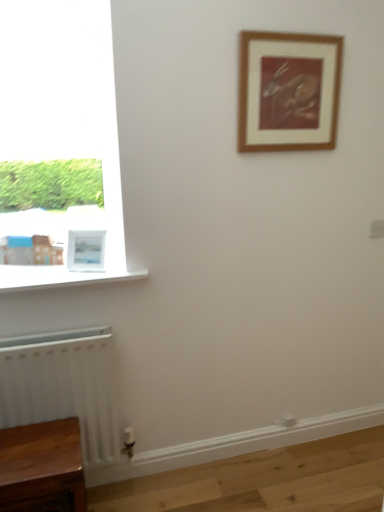
Question: Considering the relative sizes of white matte radiator at lower left and white glossy window sill at lower left in the image provided, is white matte radiator at lower left wider than white glossy window sill at lower left?

Choices:
 (A) yes
 (B) no

Answer: (B)

Question: Does white matte radiator at lower left have a lesser height compared to white glossy window sill at lower left?

Choices:
 (A) yes
 (B) no

Answer: (B)

Question: Could you tell me if white matte radiator at lower left is facing white glossy window sill at lower left?

Choices:
 (A) no
 (B) yes

Answer: (A)

Question: Is white matte radiator at lower left in contact with white glossy window sill at lower left?

Choices:
 (A) yes
 (B) no

Answer: (B)

Question: Does white matte radiator at lower left have a larger size compared to white glossy window sill at lower left?

Choices:
 (A) no
 (B) yes

Answer: (B)

Question: Which is correct: wooden framed print at upper center, arranged as the 2th picture frame when viewed from the left, is inside white matte radiator at lower left, or outside of it?

Choices:
 (A) inside
 (B) outside

Answer: (B)

Question: In terms of height, does wooden framed print at upper center, acting as the 2th picture frame starting from the bottom, look taller or shorter compared to white matte radiator at lower left?

Choices:
 (A) tall
 (B) short

Answer: (B)

Question: Would you say wooden framed print at upper center, arranged as the 2th picture frame when viewed from the left, is to the left or to the right of white matte radiator at lower left in the picture?

Choices:
 (A) left
 (B) right

Answer: (B)

Question: From the image's perspective, is wooden framed print at upper center, acting as the 2th picture frame starting from the bottom, above or below white matte radiator at lower left?

Choices:
 (A) above
 (B) below

Answer: (A)

Question: From a real-world perspective, relative to wooden table at lower left, is white glossy window sill at lower left vertically above or below?

Choices:
 (A) below
 (B) above

Answer: (B)

Question: In terms of height, does white glossy window sill at lower left look taller or shorter compared to wooden table at lower left?

Choices:
 (A) short
 (B) tall

Answer: (A)

Question: Choose the correct answer: Is white glossy window sill at lower left inside wooden table at lower left or outside it?

Choices:
 (A) inside
 (B) outside

Answer: (B)

Question: Relative to wooden table at lower left, is white glossy window sill at lower left in front or behind?

Choices:
 (A) behind
 (B) front

Answer: (A)

Question: From a real-world perspective, is wooden table at lower left positioned above or below white glossy window sill at lower left?

Choices:
 (A) above
 (B) below

Answer: (B)

Question: Is wooden table at lower left inside the boundaries of white glossy window sill at lower left, or outside?

Choices:
 (A) inside
 (B) outside

Answer: (B)